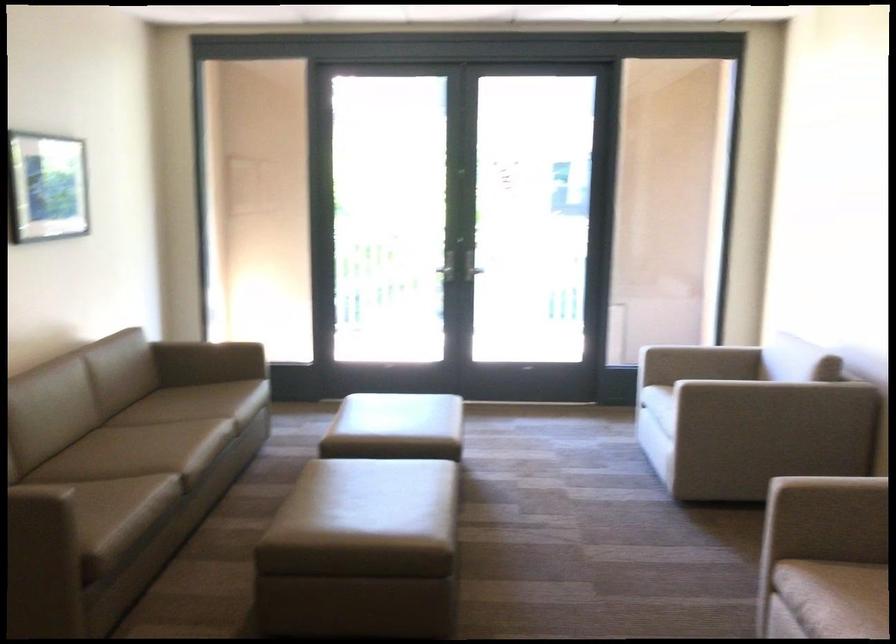
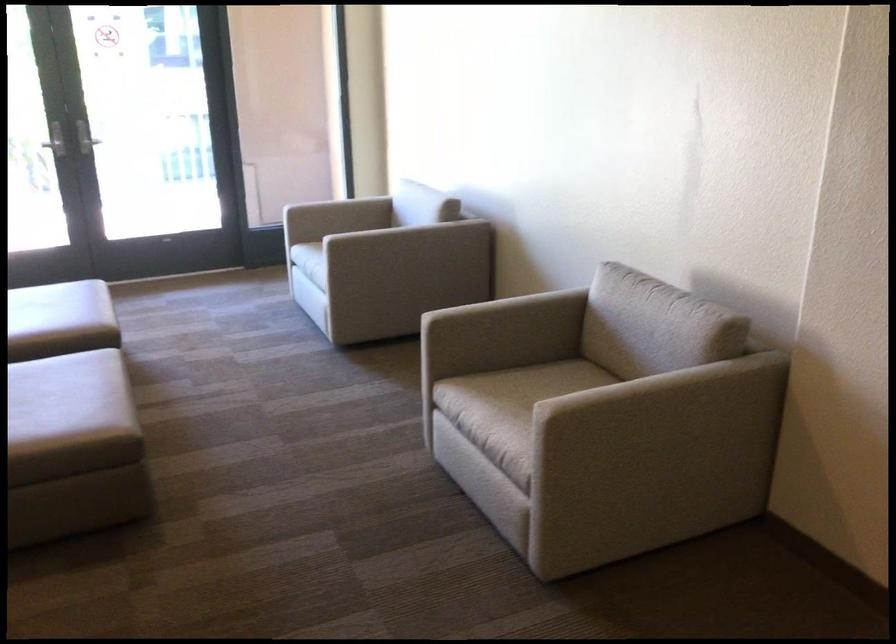
In the second image, find the point that corresponds to point (410, 487) in the first image.

(65, 384)